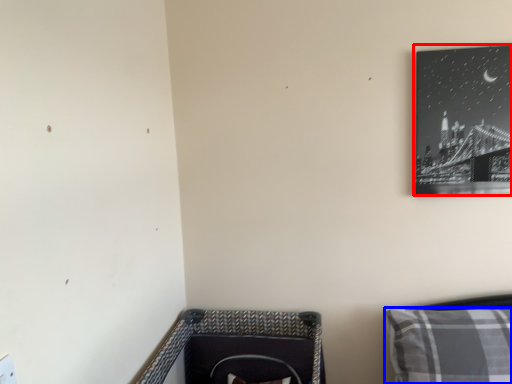
Question: Among these objects, which one is nearest to the camera, picture frame (highlighted by a red box) or pillow (highlighted by a blue box)?

Choices:
 (A) picture frame
 (B) pillow

Answer: (B)